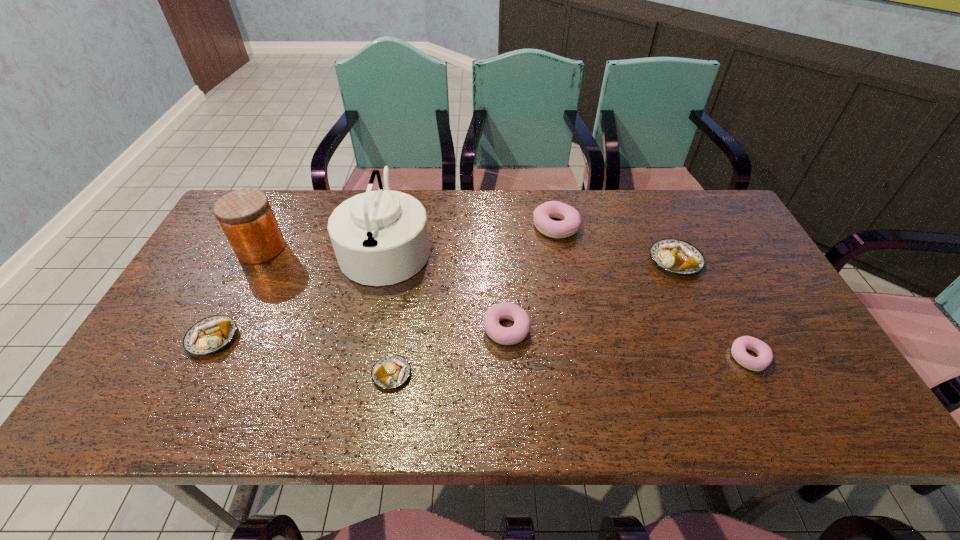
Locate an element on the screen. kettle is located at coordinates (380, 237).

This screenshot has width=960, height=540. Identify the location of the tallest object. (380, 237).

This screenshot has width=960, height=540. Identify the location of orange jar. pos(246,217).

This screenshot has width=960, height=540. In order to click on the second tallest object in this screenshot , I will do `click(246, 217)`.

Image resolution: width=960 pixels, height=540 pixels. I want to click on the third pastry from right to left, so click(x=571, y=220).

Identify the location of the biggest pink pastry. This screenshot has width=960, height=540. (571, 220).

Where is `the farthest brown pastry`? Image resolution: width=960 pixels, height=540 pixels. the farthest brown pastry is located at coordinates (675, 256).

Locate an element on the screen. the biggest brown pastry is located at coordinates (675, 256).

Identify the location of the second smallest pink pastry. (503, 335).

Find the location of `the leftmost pink pastry`. the leftmost pink pastry is located at coordinates (503, 335).